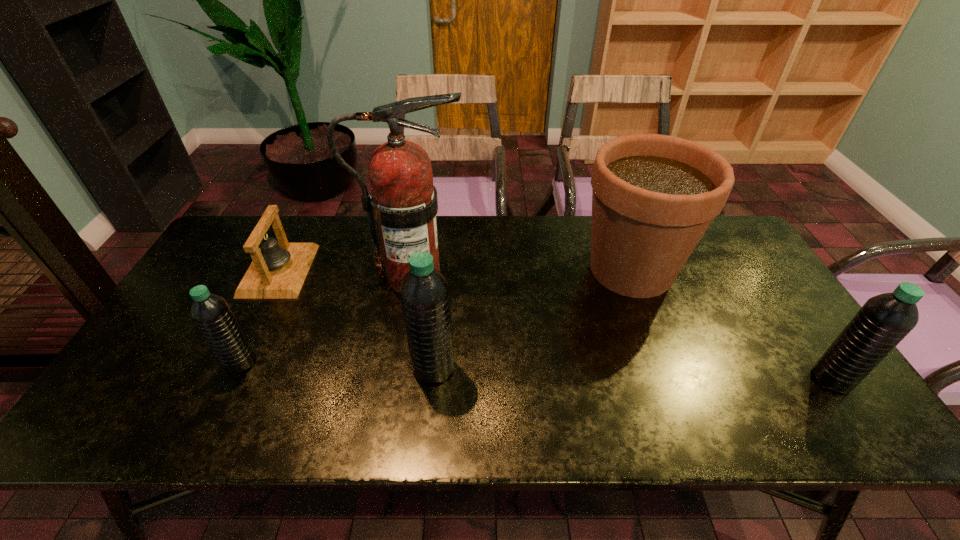
Locate an element on the screen. vacant region located 0.260m on the left of the rightmost water bottle is located at coordinates (705, 379).

At what (x,y) coordinates should I click in order to perform the action: click on free region located 0.270m on the front of the fifth object from left to right. Please return your answer as a coordinate pair (x, y). This screenshot has width=960, height=540. Looking at the image, I should click on (679, 395).

Find the location of a particular element. The width and height of the screenshot is (960, 540). vacant area situated 0.200m on the front of the bell is located at coordinates (237, 356).

Image resolution: width=960 pixels, height=540 pixels. I want to click on free space located at the nozzle of the tallest object, so click(566, 276).

This screenshot has height=540, width=960. Identify the location of flowerpot present at the far edge. (653, 196).

Locate an element on the screen. The width and height of the screenshot is (960, 540). bell at the far edge is located at coordinates (278, 270).

Where is `fire extinguisher that is at the far edge`? Image resolution: width=960 pixels, height=540 pixels. fire extinguisher that is at the far edge is located at coordinates tap(403, 201).

The image size is (960, 540). In order to click on object at the left edge in this screenshot , I will do `click(278, 270)`.

You are a GUI agent. You are given a task and a screenshot of the screen. Output one action in this format:
    pyautogui.click(x=<x>, y=<y>)
    Task: Click on the object situated at the right edge
    
    Given the screenshot: What is the action you would take?
    pyautogui.click(x=884, y=320)

The height and width of the screenshot is (540, 960). What are the coordinates of `object that is at the far left corner` in the screenshot? It's located at (278, 270).